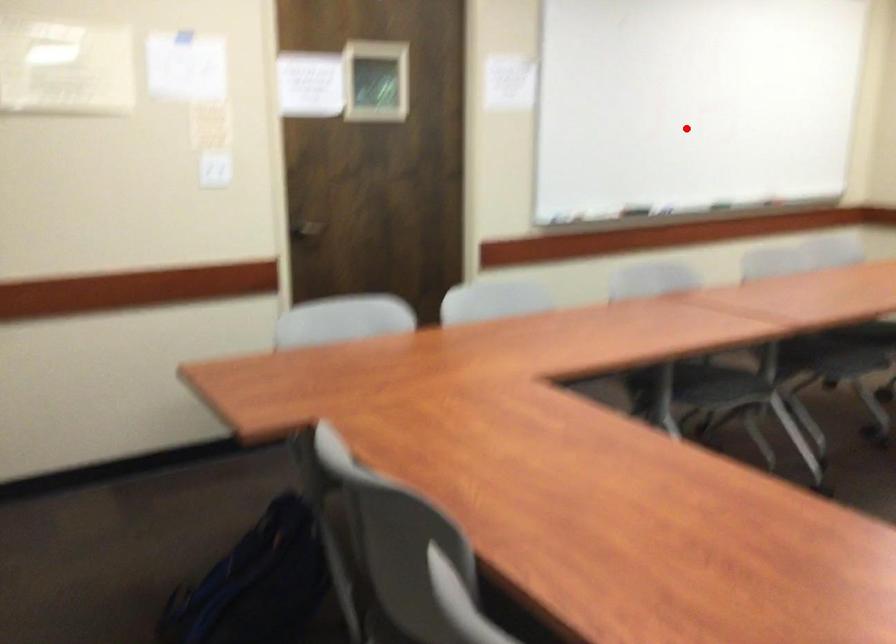
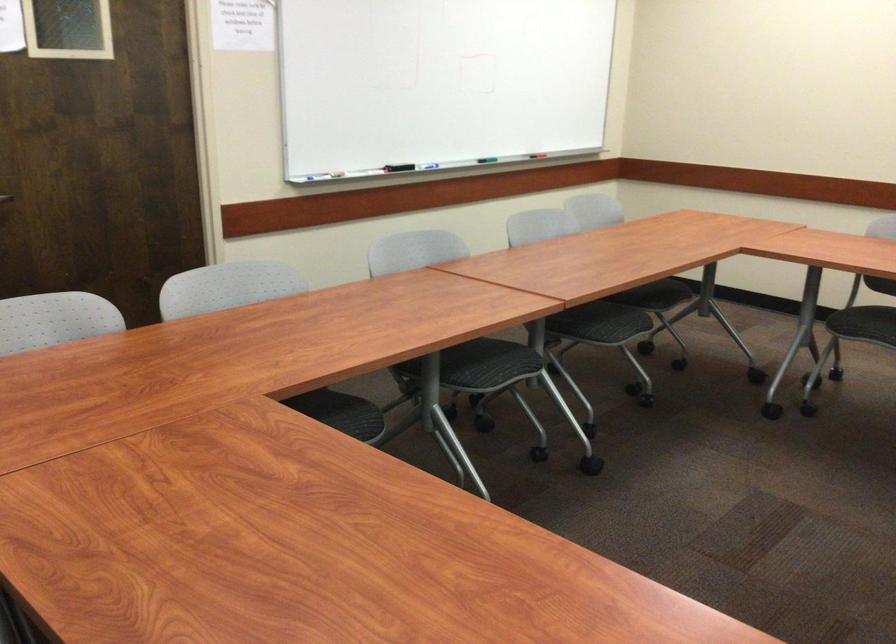
Locate, in the second image, the point that corresponds to the highlighted location in the first image.

(438, 82)